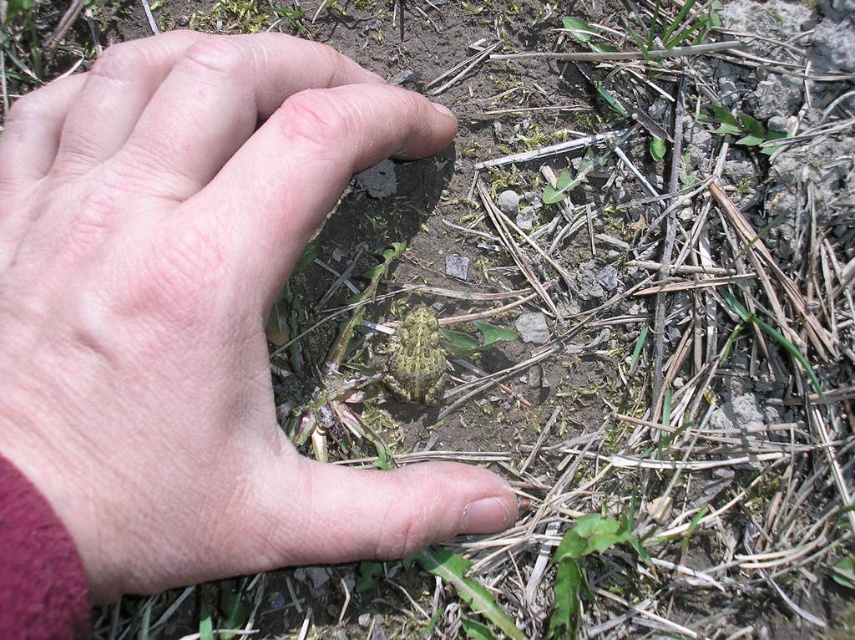
Which is in front, point (220, 156) or point (417, 349)?

Point (220, 156) is in front.

Measure the distance between pink flesh at center and camouflage skin frog at center.

pink flesh at center is 9.28 inches away from camouflage skin frog at center.

Is point (221, 124) positioned before point (394, 376)?

Yes, point (221, 124) is in front of point (394, 376).

What are the coordinates of `pink flesh at center` in the screenshot? It's located at (193, 308).